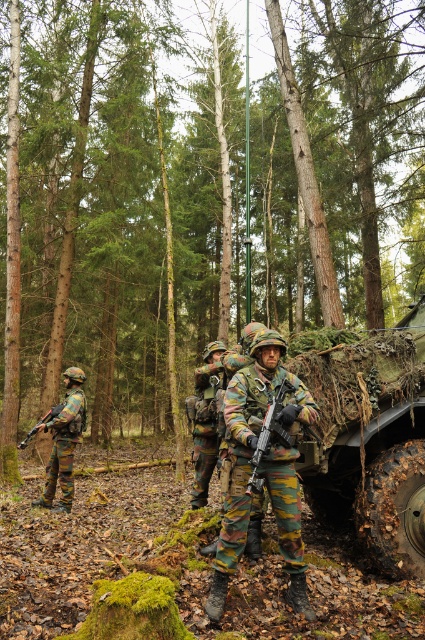
Question: Which point is closer to the camera taking this photo?

Choices:
 (A) (71, 490)
 (B) (255, 467)
 (C) (224, 500)

Answer: (B)

Question: Does camo-patterned uniform at center appear over camo fabric uniform at left?

Choices:
 (A) no
 (B) yes

Answer: (B)

Question: Which point is closer to the camera?

Choices:
 (A) coord(47,465)
 (B) coord(252,458)
 (C) coord(54,406)

Answer: (B)

Question: Is camo-patterned uniform at center to the right of camouflage-patterned rifle at left from the viewer's perspective?

Choices:
 (A) no
 (B) yes

Answer: (B)

Question: Can you confirm if camo-patterned uniform at center is positioned below camouflage-patterned rifle at left?

Choices:
 (A) yes
 (B) no

Answer: (B)

Question: Estimate the real-world distances between objects in this image. Which object is farther from the camo fabric uniform at left?

Choices:
 (A) camouflage-patterned rifle at center
 (B) camouflage-patterned rifle at left

Answer: (A)